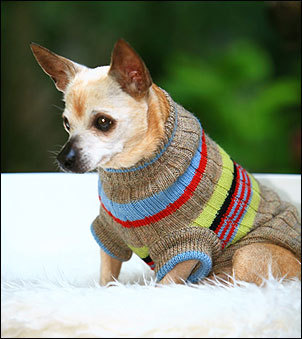
Find the location of a particular element. This screenshot has width=302, height=339. fur is located at coordinates (147, 139).